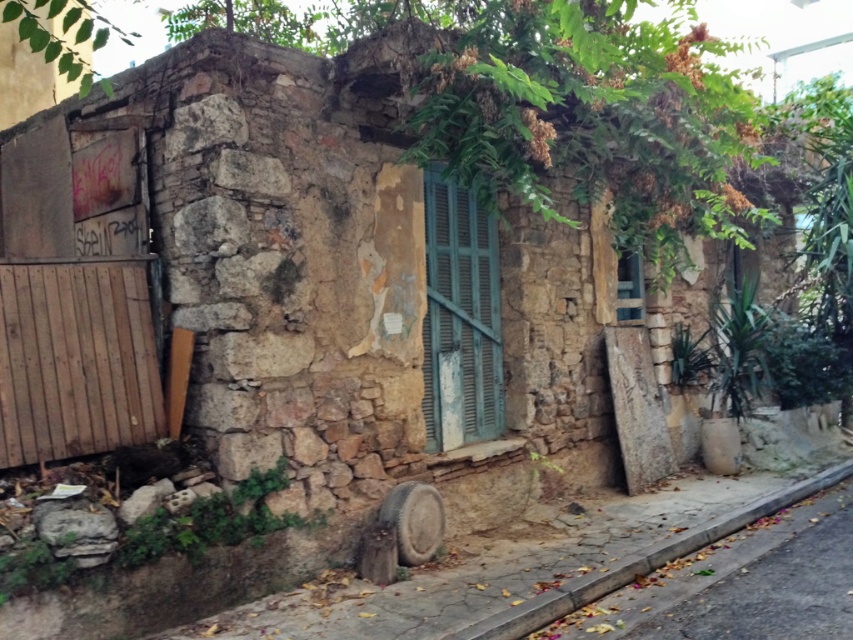
Question: Which of the following is the closest to the observer?

Choices:
 (A) gray concrete curb at lower right
 (B) green painted wood shutter at center

Answer: (A)

Question: Is green painted wood shutter at center thinner than gray concrete curb at lower right?

Choices:
 (A) yes
 (B) no

Answer: (A)

Question: Which point is closer to the camera taking this photo?

Choices:
 (A) (554, 600)
 (B) (482, 349)

Answer: (A)

Question: Which of the following is the closest to the observer?

Choices:
 (A) green painted wood shutter at center
 (B) gray concrete curb at lower right

Answer: (B)

Question: Can you confirm if green painted wood shutter at center is wider than gray concrete curb at lower right?

Choices:
 (A) yes
 (B) no

Answer: (B)

Question: Can you confirm if green painted wood shutter at center is positioned below gray concrete curb at lower right?

Choices:
 (A) yes
 (B) no

Answer: (B)